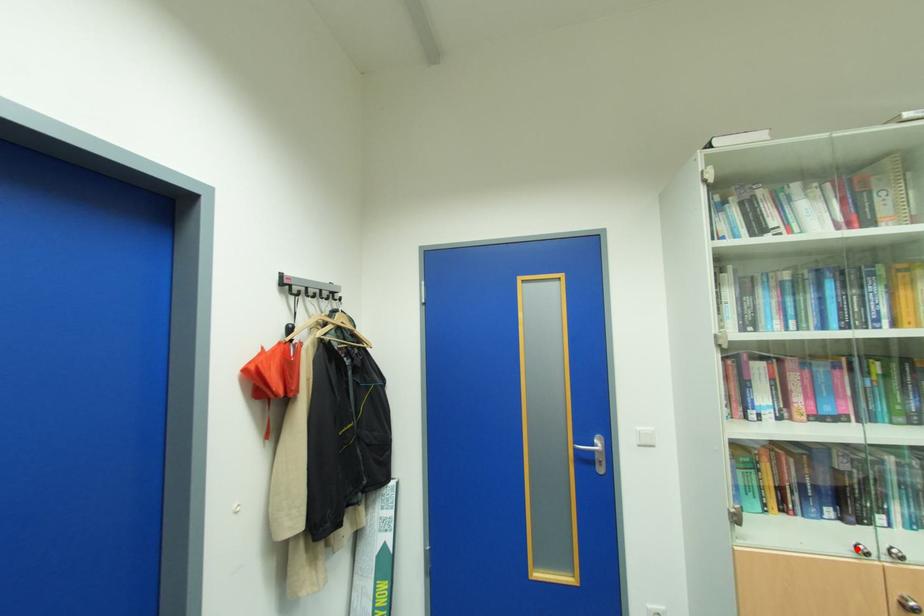
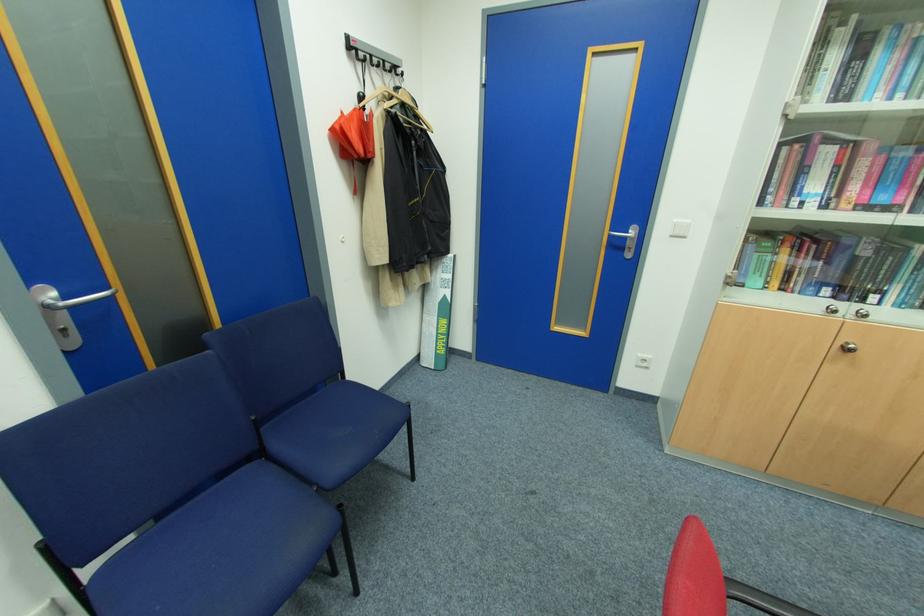
Question: I am providing you with two images of the same scene from different viewpoints. A red point is marked on the first image. At the location where the point appears in image 1, is it still visible in image 2?

Choices:
 (A) Yes
 (B) No

Answer: (A)